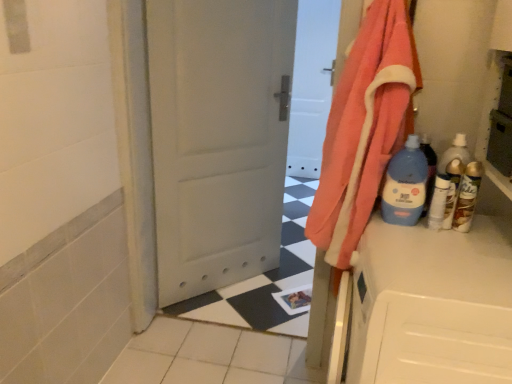
Question: Is point (335, 195) closer or farther from the camera than point (430, 210)?

Choices:
 (A) closer
 (B) farther

Answer: (B)

Question: From their relative heights in the image, would you say orange cotton towel at right is taller or shorter than white glossy bottle at right, the 2th bottle from the left?

Choices:
 (A) short
 (B) tall

Answer: (B)

Question: Which object is positioned farthest from the white glossy bottle at right, arranged as the 3th bottle when viewed from the right?

Choices:
 (A) clear plastic bottle at right, which is the second bottle in right-to-left order
 (B) gold metallic spray can at right, placed as the first bottle when sorted from right to left
 (C) blue plastic bottle at right, placed as the 1th bottle when sorted from left to right
 (D) white matte counter top at right
 (E) orange cotton towel at right

Answer: (E)

Question: Considering the real-world distances, which object is farthest from the orange cotton towel at right?

Choices:
 (A) blue plastic bottle at right, placed as the 4th bottle when sorted from right to left
 (B) white glossy bottle at right, arranged as the 3th bottle when viewed from the right
 (C) gold metallic spray can at right, marked as the fourth bottle in a left-to-right arrangement
 (D) clear plastic bottle at right, the third bottle positioned from the left
 (E) white matte counter top at right

Answer: (C)